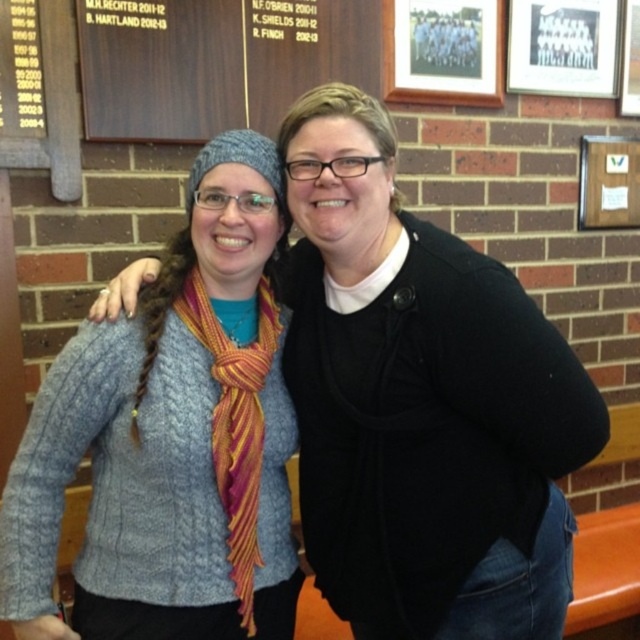
Question: Which point is farther to the camera?

Choices:
 (A) (259, 416)
 (B) (129, 499)
 (C) (440, 273)

Answer: (A)

Question: Is the position of knitted blue sweater at center more distant than that of knitted wool scarf at center?

Choices:
 (A) no
 (B) yes

Answer: (A)

Question: Which point is closer to the camera?

Choices:
 (A) knitted blue sweater at center
 (B) knitted gray sweater at center
 (C) knitted wool scarf at center

Answer: (A)

Question: Among these points, which one is nearest to the camera?

Choices:
 (A) (412, 364)
 (B) (252, 525)

Answer: (A)

Question: In this image, where is knitted blue sweater at center located relative to knitted gray sweater at center?

Choices:
 (A) left
 (B) right

Answer: (B)

Question: Does knitted gray sweater at center have a greater width compared to knitted wool scarf at center?

Choices:
 (A) yes
 (B) no

Answer: (A)